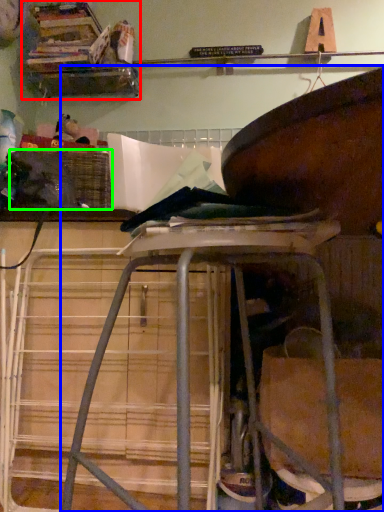
Question: Estimate the real-world distances between objects in this image. Which object is farther from shelf (highlighted by a red box), furniture (highlighted by a blue box) or crate (highlighted by a green box)?

Choices:
 (A) furniture
 (B) crate

Answer: (A)